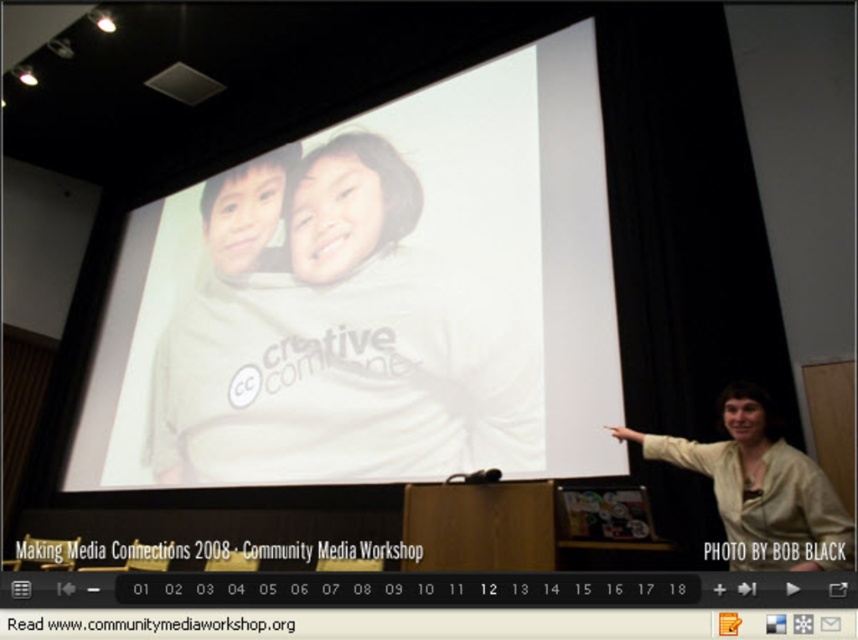
Is white matte screen at center thinner than matte beige hoodie at center?

No.

Between point (366, 428) and point (466, 381), which one is positioned behind?

Point (366, 428)

Between point (420, 186) and point (287, 227), which one is positioned in front?

Point (420, 186)

The image size is (858, 640). I want to click on white matte screen at center, so click(373, 300).

Is matte beige hoodie at center bigger than yellow fabric at right?

Yes, matte beige hoodie at center is bigger than yellow fabric at right.

Does matte beige hoodie at center have a lesser width compared to yellow fabric at right?

Incorrect, matte beige hoodie at center's width is not less than yellow fabric at right's.

Is point (505, 392) positioned in front of point (843, 525)?

That is False.

What are the coordinates of `matte beige hoodie at center` in the screenshot? It's located at (327, 337).

Is yellow fabric at right smaller than light beige fabric at center?

Yes, yellow fabric at right is smaller than light beige fabric at center.

Is yellow fabric at right taller than light beige fabric at center?

In fact, yellow fabric at right may be shorter than light beige fabric at center.

Is point (826, 550) more distant than point (234, 200)?

No.

Find the location of a particular element. The height and width of the screenshot is (640, 858). yellow fabric at right is located at coordinates (760, 490).